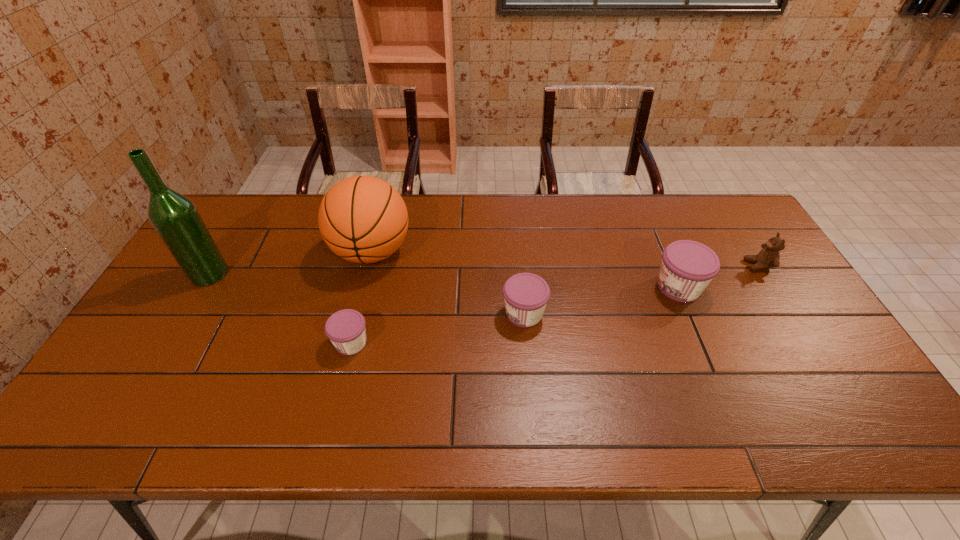
The image size is (960, 540). I want to click on free space at the right edge, so click(725, 246).

Locate an element on the screen. This screenshot has width=960, height=540. free space at the far left corner is located at coordinates (244, 219).

Where is `free space at the near left corner of the desktop`? This screenshot has height=540, width=960. free space at the near left corner of the desktop is located at coordinates (121, 384).

This screenshot has height=540, width=960. Find the location of `free space at the near right corner of the desktop`. free space at the near right corner of the desktop is located at coordinates (852, 376).

Identify the location of unoccupied area between the fifth object from left to right and the fifth shortest object. Image resolution: width=960 pixels, height=540 pixels. (525, 269).

Identify the location of vacant area that lies between the fifth object from left to right and the second tallest jam. (601, 300).

Where is `free area in between the rightmost object and the leftmost object`? free area in between the rightmost object and the leftmost object is located at coordinates (484, 269).

Find the location of a particular element. The height and width of the screenshot is (540, 960). vacant space that is in between the leftmost jam and the teddy bear is located at coordinates (555, 304).

Locate an element on the screen. This screenshot has height=540, width=960. vacant space that is in between the rightmost object and the fourth object from left to right is located at coordinates [x=641, y=289].

Where is `vacant area that lies between the leftmost jam and the third object from right to left`? This screenshot has height=540, width=960. vacant area that lies between the leftmost jam and the third object from right to left is located at coordinates (438, 328).